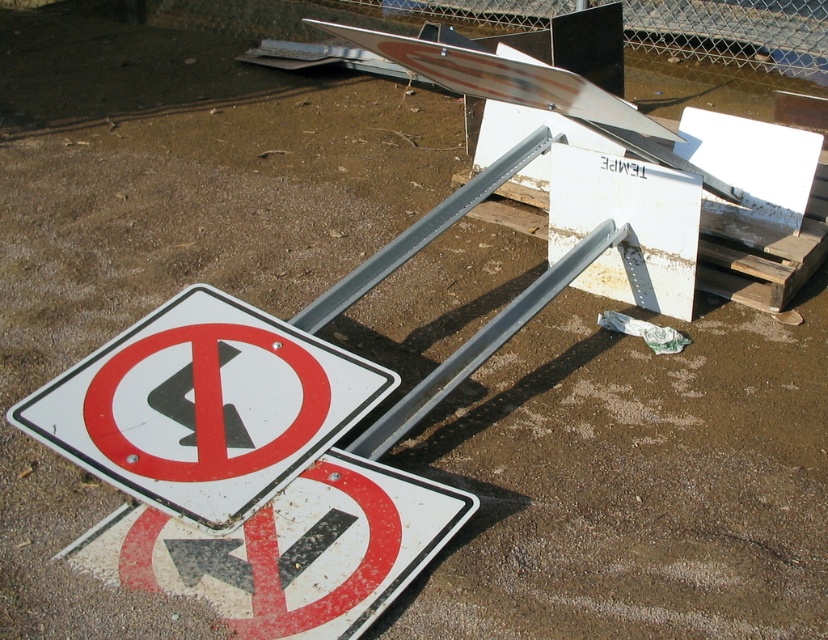
Can you confirm if white matte traffic sign at lower left is smaller than white plastic traffic sign at lower left?

No, white matte traffic sign at lower left is not smaller than white plastic traffic sign at lower left.

Does point (297, 448) lie in front of point (366, 492)?

No, it is not.

This screenshot has height=640, width=828. What do you see at coordinates (203, 406) in the screenshot?
I see `white matte traffic sign at lower left` at bounding box center [203, 406].

Locate an element on the screen. white matte traffic sign at lower left is located at coordinates (203, 406).